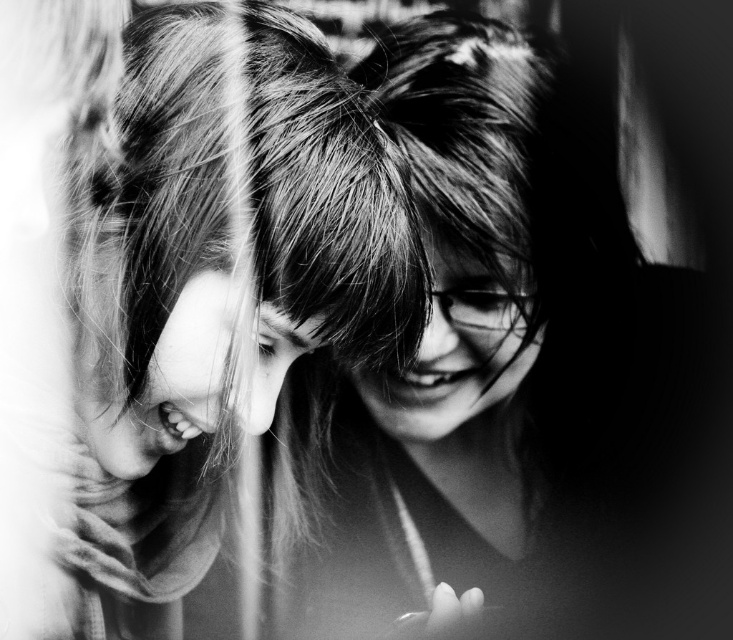
Does smooth hair at center appear under shiny hair at center?

Yes, smooth hair at center is below shiny hair at center.

What are the coordinates of `smooth hair at center` in the screenshot? It's located at (221, 291).

Identify the location of smooth hair at center. (221, 291).